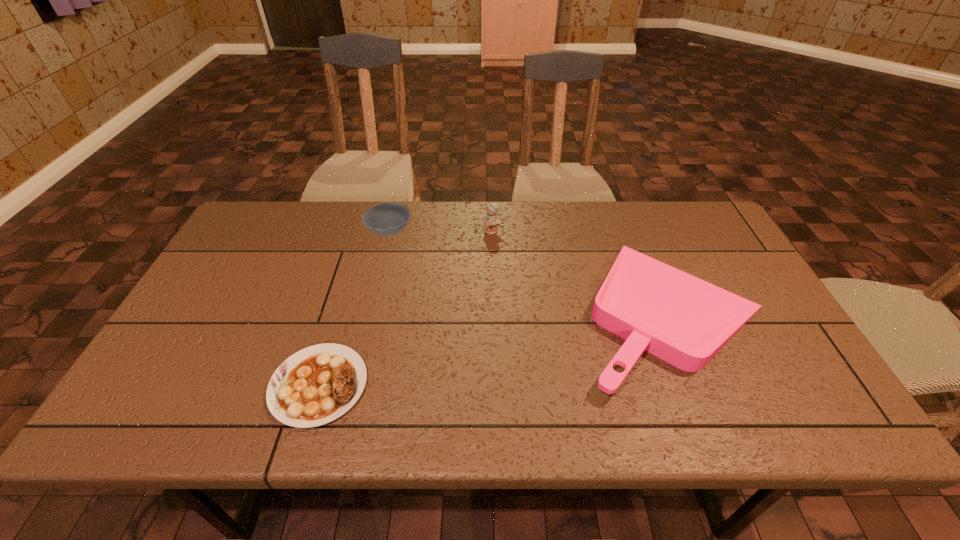
Find the location of a particular element. This screenshot has height=540, width=960. free spot located 0.080m on the right of the steak is located at coordinates tap(402, 385).

This screenshot has height=540, width=960. I want to click on teddy bear that is at the far edge, so click(x=491, y=220).

Locate an element on the screen. bowl that is at the far edge is located at coordinates (387, 219).

Find the location of `dustpan situated at the far edge`. dustpan situated at the far edge is located at coordinates (681, 319).

The width and height of the screenshot is (960, 540). Find the location of `dustpan at the near edge`. dustpan at the near edge is located at coordinates (681, 319).

You are a GUI agent. You are given a task and a screenshot of the screen. Output one action in this format:
    pyautogui.click(x=<x>, y=<y>)
    Task: Click on the steak at the near edge
    This screenshot has height=540, width=960.
    Given the screenshot: What is the action you would take?
    318,384

At what (x,y) coordinates should I click in order to perform the action: click on object at the right edge. Please return your answer as a coordinate pair (x, y). Image resolution: width=960 pixels, height=540 pixels. Looking at the image, I should click on (681, 319).

This screenshot has height=540, width=960. I want to click on object at the far right corner, so click(681, 319).

Where is `object present at the near right corner`? This screenshot has height=540, width=960. object present at the near right corner is located at coordinates (681, 319).

Find the location of `vacant space at the far edge of the desktop`. vacant space at the far edge of the desktop is located at coordinates (465, 213).